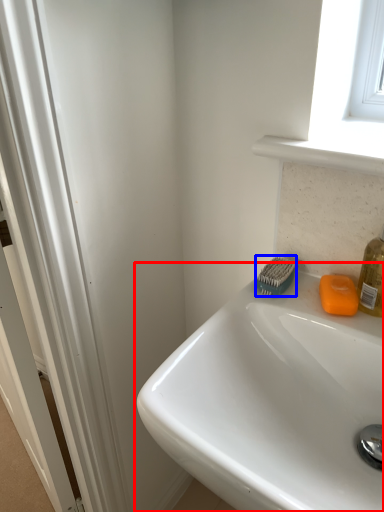
Question: Among these objects, which one is nearest to the camera, sink (highlighted by a red box) or brush (highlighted by a blue box)?

Choices:
 (A) sink
 (B) brush

Answer: (A)